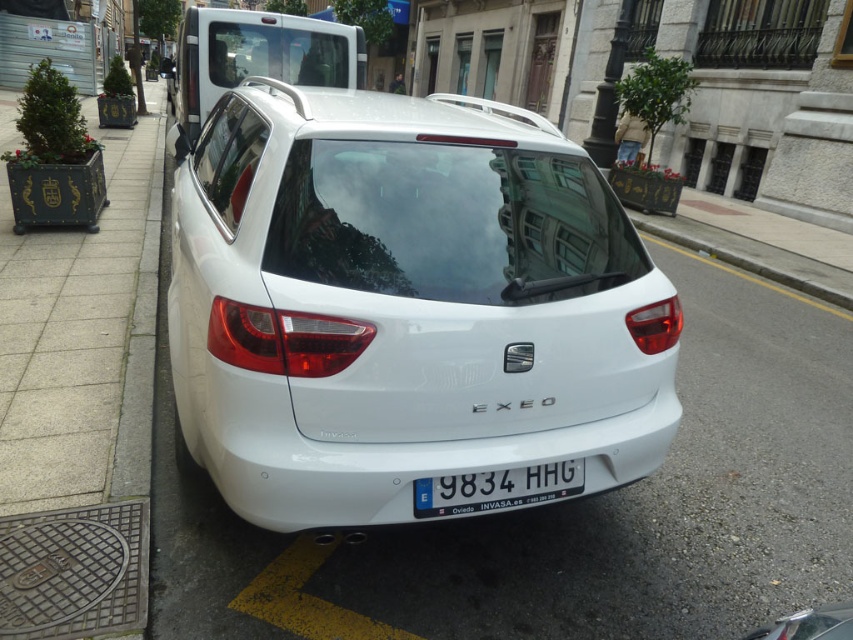
Question: Which of the following is the closest to the observer?

Choices:
 (A) (424, 493)
 (B) (380, 294)

Answer: (B)

Question: From the image, what is the correct spatial relationship of white matte hatchback at center in relation to white plastic license plate at center?

Choices:
 (A) below
 (B) above

Answer: (B)

Question: Where is white matte hatchback at center located in relation to white plastic license plate at center in the image?

Choices:
 (A) left
 (B) right

Answer: (A)

Question: Which object is farther from the camera taking this photo?

Choices:
 (A) white plastic license plate at center
 (B) white matte hatchback at center

Answer: (A)

Question: Can you confirm if white matte hatchback at center is positioned above white plastic license plate at center?

Choices:
 (A) no
 (B) yes

Answer: (B)

Question: Which of the following is the closest to the observer?

Choices:
 (A) white plastic license plate at center
 (B) white matte hatchback at center

Answer: (B)